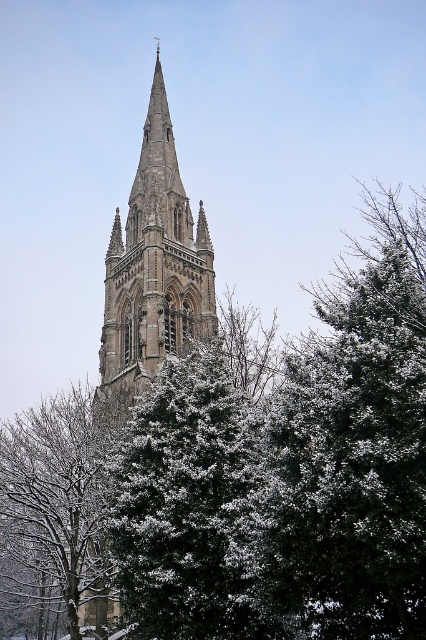
Based on the photo, measure the distance between point (146,525) and camera.

Point (146,525) is 185.56 feet from camera.

Is green textured pine tree at center to the left of snow-covered evergreen tree at center from the viewer's perspective?

No, green textured pine tree at center is not to the left of snow-covered evergreen tree at center.

At what (x,y) coordinates should I click in order to perform the action: click on green textured pine tree at center. Please return your answer as a coordinate pair (x, y). The image size is (426, 640). Looking at the image, I should click on (189, 506).

Is green textured pine tree at center smaller than stone gothic tower at center?

Yes, green textured pine tree at center is smaller than stone gothic tower at center.

Does green textured pine tree at center appear under stone gothic tower at center?

Indeed, green textured pine tree at center is positioned under stone gothic tower at center.

Image resolution: width=426 pixels, height=640 pixels. What do you see at coordinates (189, 506) in the screenshot? I see `green textured pine tree at center` at bounding box center [189, 506].

Identify the location of green textured pine tree at center. The width and height of the screenshot is (426, 640). (189, 506).

Who is more distant from viewer, (83, 488) or (176, 208)?

Point (176, 208)

Who is higher up, snow-covered evergreen tree at center or stone gothic tower at center?

stone gothic tower at center

In the scene shown: Who is more distant from viewer, [68,547] or [147,300]?

Positioned behind is point [147,300].

This screenshot has height=640, width=426. In order to click on snow-covered evergreen tree at center in this screenshot , I will do `click(55, 512)`.